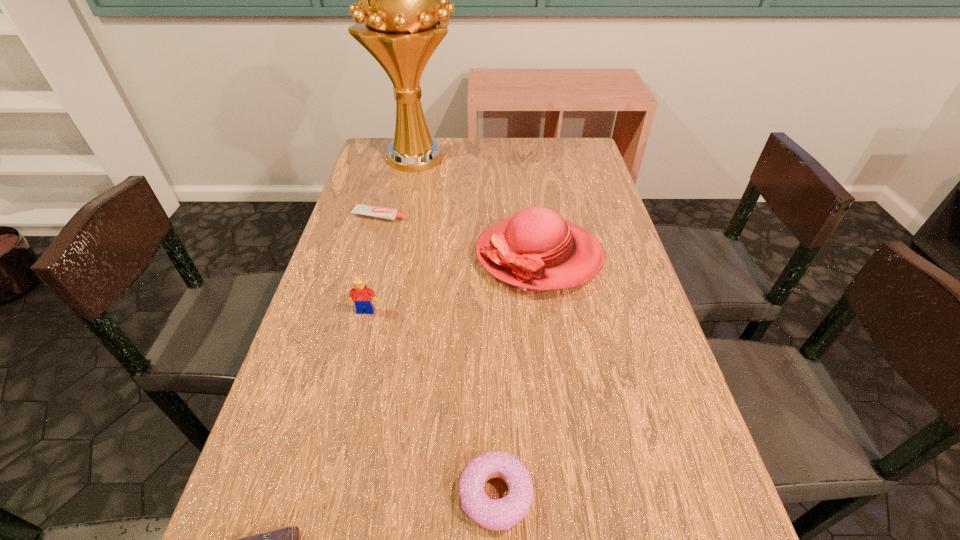
Where is `vacant space that's between the second shortest object and the tallest object`? vacant space that's between the second shortest object and the tallest object is located at coordinates (398, 186).

Select which object is the fifth closest to the hat. Please provide its 2D coordinates. Your answer should be formatted as a tuple, i.e. [(x, y)], where the tuple contains the x and y coordinates of a point satisfying the conditions above.

[(287, 539)]

Where is `object that is the fourth closest to the trophy_cup`? The width and height of the screenshot is (960, 540). object that is the fourth closest to the trophy_cup is located at coordinates (501, 514).

Image resolution: width=960 pixels, height=540 pixels. In order to click on free spot that satisfies the following two spatial constraints: 1. on the front side of the doughnut; 2. on the right side of the toothpaste in this screenshot , I will do `click(302, 495)`.

The width and height of the screenshot is (960, 540). Identify the location of free region that satisfies the following two spatial constraints: 1. at the front of the trophy_cup where the globe is prominent; 2. on the left side of the third shortest object. (348, 495).

Image resolution: width=960 pixels, height=540 pixels. Identify the location of vacant area that satisfies the following two spatial constraints: 1. at the front of the hat with a bow; 2. on the front-facing side of the fourth farthest object. click(x=546, y=311).